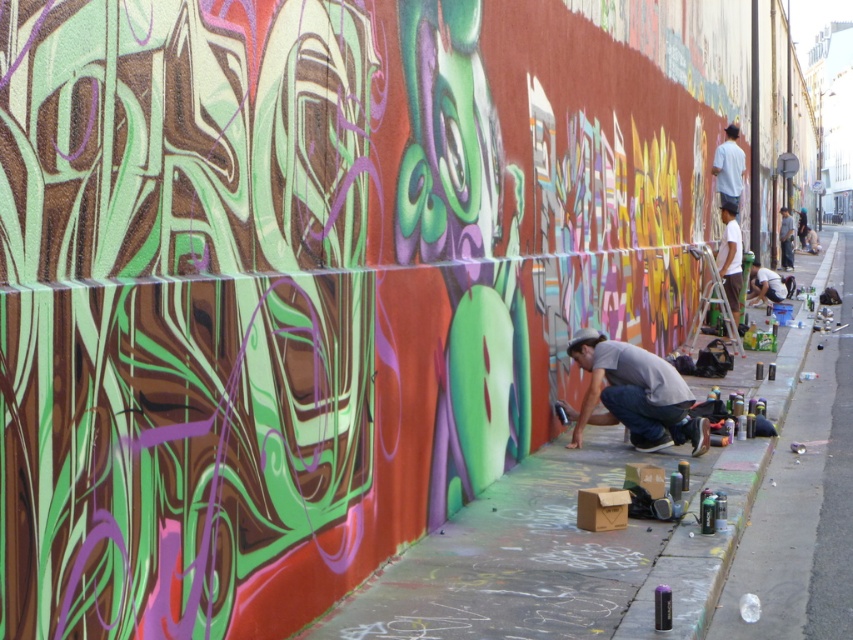
You are a city planner reviewing this street art scene. The city requires all public art installations to have a clear 1.5 meter safety zone around any permanent fixtures. Given the location of the matte black squat at lower right, can you confirm if there is enough space around it to comply with this regulation?

The matte black squat at lower right is located at point (764, 284). Since the safety zone requires 1.5 meters around it, and the coordinates alone do not provide spatial dimensions or distance from other objects, it is impossible to confirm compliance without additional measurements.

You are a city planner assessing the space for a new public art installation. Given the scene, which object would you prioritize for safety considerations, the concrete sidewalk at center or the dark gray shirt at lower right, and why?

The concrete sidewalk at center should be prioritized for safety considerations because it has a larger size compared to the dark gray shirt at lower right, making it a more significant structural component in the public space.